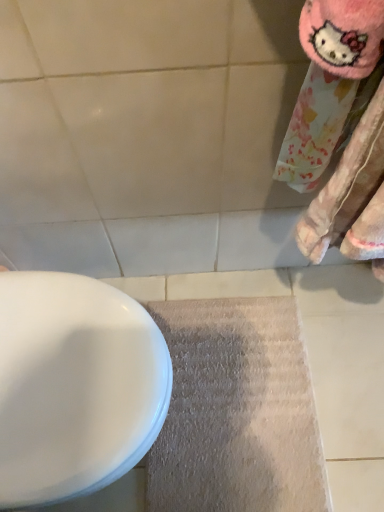
Question: Is gray carpet at lower center bigger or smaller than white glossy toilet at lower left?

Choices:
 (A) small
 (B) big

Answer: (A)

Question: In the image, is gray carpet at lower center positioned in front of or behind white glossy toilet at lower left?

Choices:
 (A) behind
 (B) front

Answer: (A)

Question: In terms of height, does gray carpet at lower center look taller or shorter compared to white glossy toilet at lower left?

Choices:
 (A) tall
 (B) short

Answer: (B)

Question: From the image's perspective, is white glossy toilet at lower left located above or below gray carpet at lower center?

Choices:
 (A) below
 (B) above

Answer: (B)

Question: Does point (16, 272) appear closer or farther from the camera than point (261, 477)?

Choices:
 (A) farther
 (B) closer

Answer: (B)

Question: Relative to gray carpet at lower center, is white glossy toilet at lower left in front or behind?

Choices:
 (A) behind
 (B) front

Answer: (B)

Question: Is white glossy toilet at lower left to the left or to the right of gray carpet at lower center in the image?

Choices:
 (A) right
 (B) left

Answer: (B)